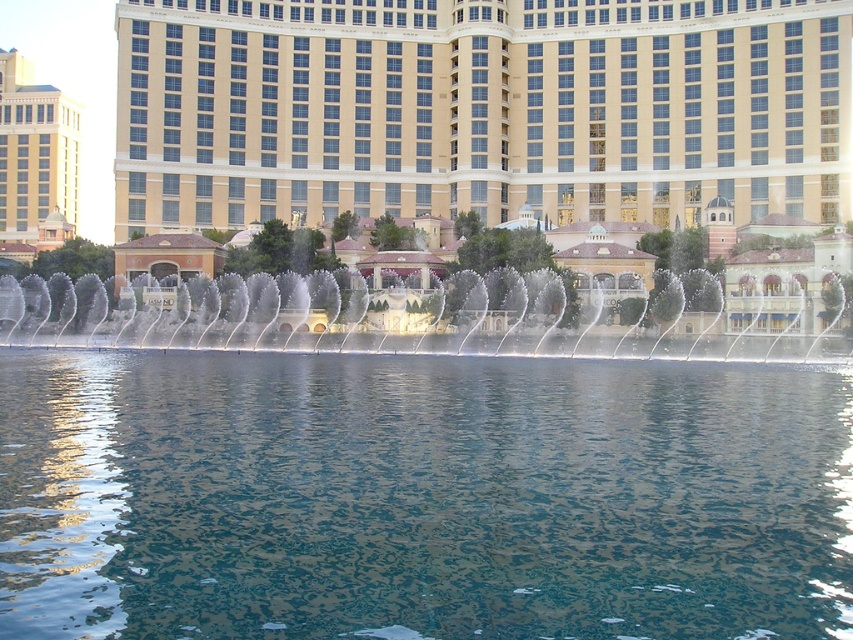
The width and height of the screenshot is (853, 640). Describe the element at coordinates (358, 321) in the screenshot. I see `clear water jets at center` at that location.

Who is positioned more to the left, clear water jets at center or beige stone building at left?

beige stone building at left

Does point (837, 330) come in front of point (30, 147)?

Yes, point (837, 330) is closer to viewer.

The height and width of the screenshot is (640, 853). I want to click on clear water jets at center, so click(x=358, y=321).

Is clear water at center smaller than clear water jets at center?

Actually, clear water at center might be larger than clear water jets at center.

Does clear water at center have a greater height compared to clear water jets at center?

In fact, clear water at center may be shorter than clear water jets at center.

Who is more forward, (741, 408) or (76, 291)?

Positioned in front is point (741, 408).

Where is `clear water at center`? This screenshot has width=853, height=640. clear water at center is located at coordinates (421, 497).

Is beige/smooth/facade at center thinner than beige stone building at left?

No, beige/smooth/facade at center is not thinner than beige stone building at left.

Who is more forward, (311, 93) or (20, 141)?

Point (311, 93)

Is point (780, 202) more distant than point (68, 196)?

No, it is in front of (68, 196).

Where is `beige/smooth/facade at center`? beige/smooth/facade at center is located at coordinates (479, 109).